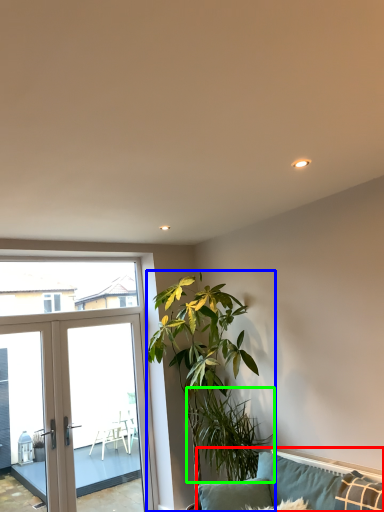
Question: Which object is the closest to the studio couch (highlighted by a red box)? Choose among these: houseplant (highlighted by a blue box) or plant (highlighted by a green box).

Choices:
 (A) houseplant
 (B) plant

Answer: (B)